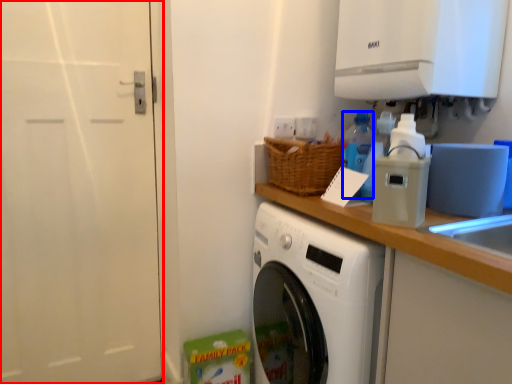
Question: Which object appears closest to the camera in this image, screen door (highlighted by a red box) or bottle (highlighted by a blue box)?

Choices:
 (A) screen door
 (B) bottle

Answer: (A)